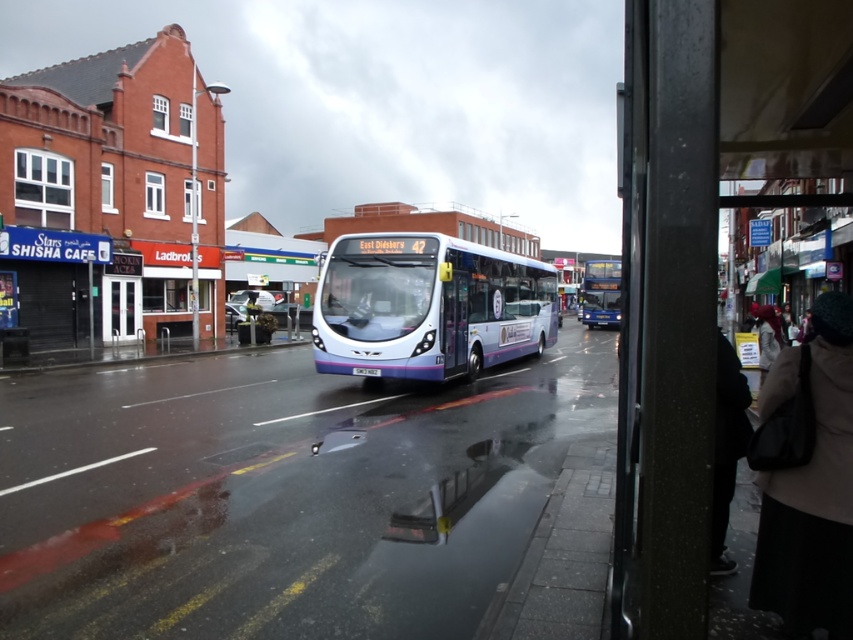
Question: Does beige wool coat at lower right appear under white fabric hat at lower right?

Choices:
 (A) yes
 (B) no

Answer: (A)

Question: Where is beige wool coat at lower right located in relation to metallic silver bus at center in the image?

Choices:
 (A) below
 (B) above

Answer: (A)

Question: Where is dark gray fabric jacket at lower right located in relation to white fabric hat at lower right in the image?

Choices:
 (A) above
 (B) below

Answer: (B)

Question: Which object appears farthest from the camera in this image?

Choices:
 (A) beige wool coat at lower right
 (B) metallic silver bus at center

Answer: (B)

Question: Estimate the real-world distances between objects in this image. Which object is closer to the white fabric hat at lower right?

Choices:
 (A) metallic silver bus at center
 (B) white glossy bus at center

Answer: (B)

Question: Which point is farther from the camera taking this photo?

Choices:
 (A) (587, 282)
 (B) (733, 403)
 (C) (799, 563)
 (D) (757, 307)

Answer: (A)